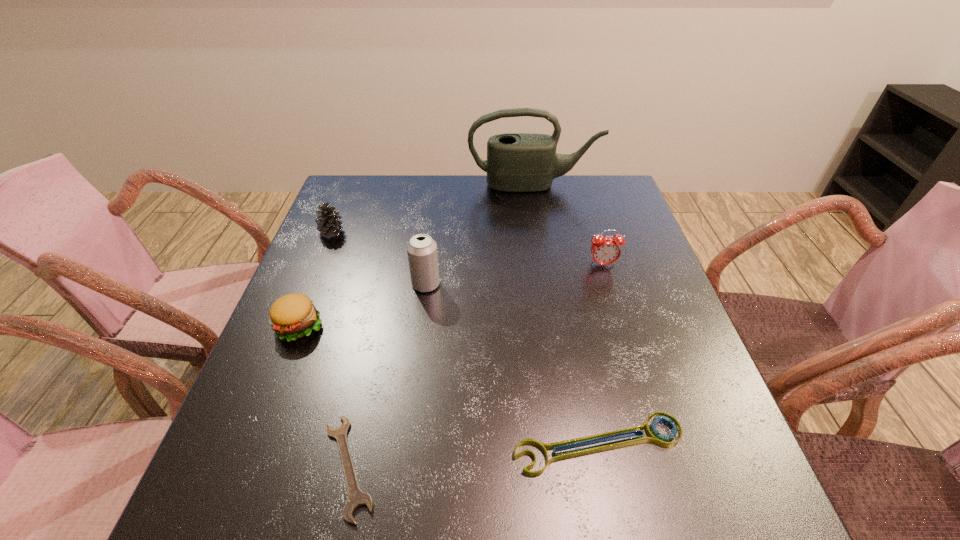
Identify the location of the taller wrench. (654, 436).

Find the location of a particular element. the third object from left to right is located at coordinates (x=355, y=497).

Locate an element on the screen. The height and width of the screenshot is (540, 960). the shortest object is located at coordinates (355, 497).

The height and width of the screenshot is (540, 960). I want to click on vacant region located on the spout of the tallest object, so click(x=541, y=233).

Image resolution: width=960 pixels, height=540 pixels. I want to click on vacant space located 0.160m on the left of the fourth nearest object, so click(x=345, y=284).

This screenshot has width=960, height=540. What are the coordinates of `vacant space located on the face of the fifth nearest object` in the screenshot? It's located at (625, 339).

What are the coordinates of `blank space located on the right of the second farthest object` in the screenshot? It's located at (399, 232).

Identify the location of vacant space located on the front of the third nearest object. (256, 437).

Where is `vacant space situated on the back of the taller wrench`? This screenshot has height=540, width=960. vacant space situated on the back of the taller wrench is located at coordinates (574, 323).

The width and height of the screenshot is (960, 540). Identify the location of free space located on the right of the third object from left to right. (566, 467).